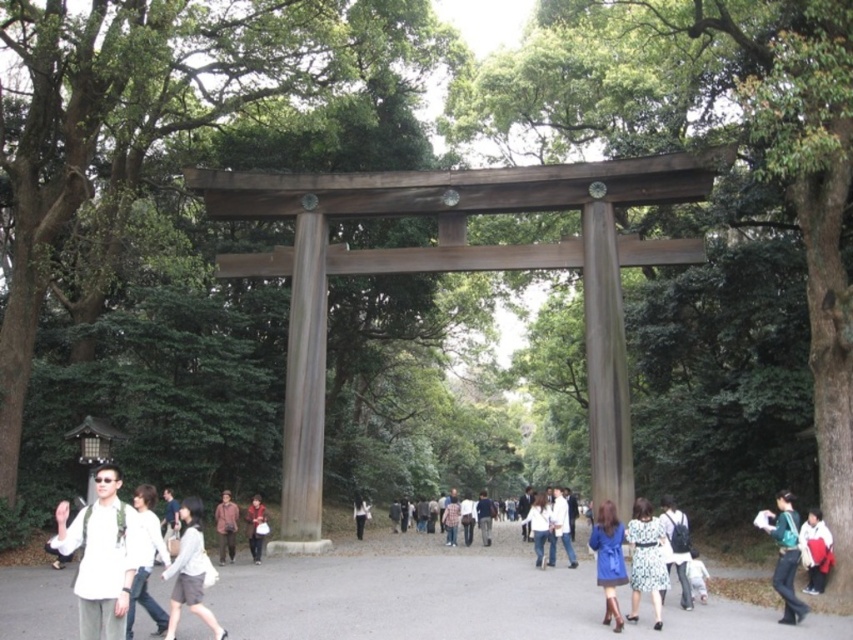
Question: Can you confirm if matte gray sweater at center is wider than patterned fabric dress at center?

Choices:
 (A) yes
 (B) no

Answer: (A)

Question: Among these points, which one is nearest to the camera?

Choices:
 (A) (102, 563)
 (B) (206, 616)
 (C) (357, 508)

Answer: (A)

Question: Which point is closer to the camera taking this photo?

Choices:
 (A) (175, 531)
 (B) (218, 512)
 (C) (811, 580)

Answer: (C)

Question: Does smooth asphalt path at center have a larger size compared to light gray fabric jacket at lower left?

Choices:
 (A) no
 (B) yes

Answer: (B)

Question: Is matte gray sweater at center smaller than matte blue coat at center?

Choices:
 (A) yes
 (B) no

Answer: (B)

Question: Which object appears closest to the camera in this image?

Choices:
 (A) patterned fabric dress at center
 (B) brown leather jacket at center
 (C) matte gray coat at center

Answer: (A)